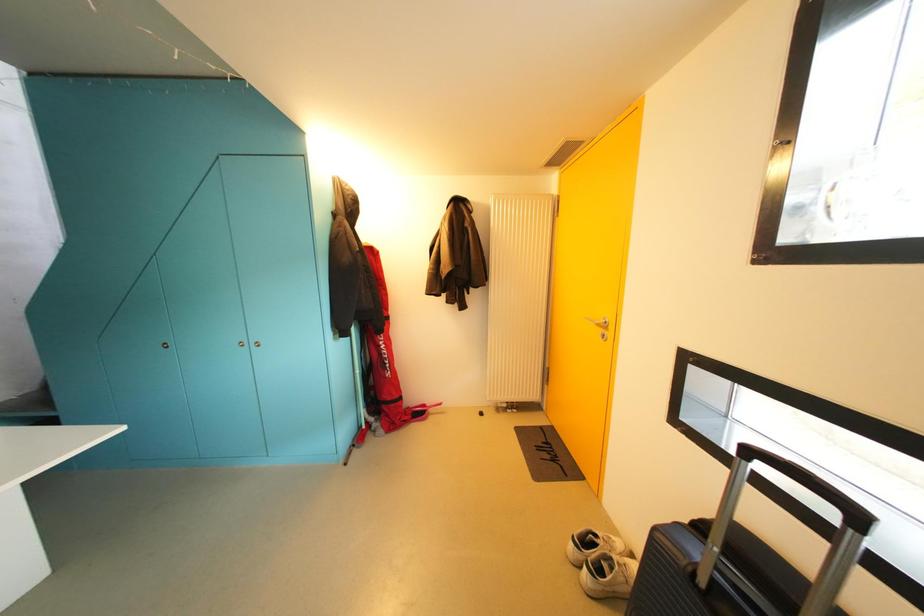
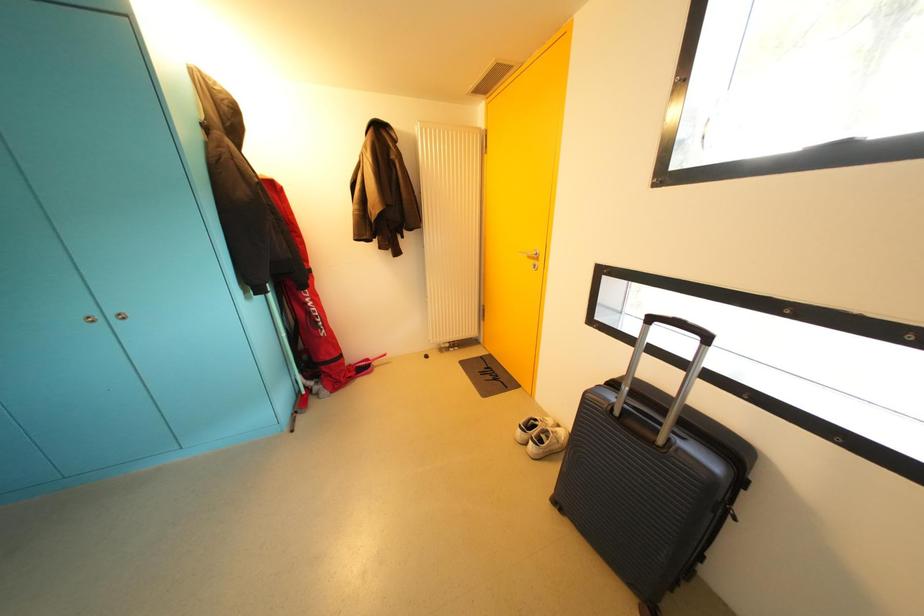
Question: The camera is either moving clockwise (left) or counter-clockwise (right) around the object. The first image is from the beginning of the video and the second image is from the end. Is the camera moving left or right when shooting the video?

Choices:
 (A) Left
 (B) Right

Answer: (A)